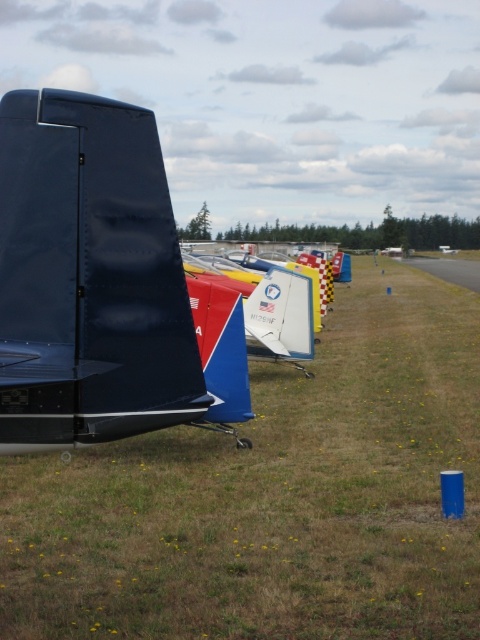
Question: Considering the real-world distances, which object is closest to the green grass at center?

Choices:
 (A) metallic silver airplane at center
 (B) matte black airplane at center

Answer: (B)

Question: Which point is closer to the camera?

Choices:
 (A) matte black airplane at center
 (B) metallic silver airplane at center

Answer: (A)

Question: Can you confirm if matte black airplane at center is smaller than metallic silver airplane at center?

Choices:
 (A) yes
 (B) no

Answer: (B)

Question: In this image, where is green grass at center located relative to matte black airplane at center?

Choices:
 (A) right
 (B) left

Answer: (A)

Question: Among these points, which one is farthest from the camera?

Choices:
 (A) (231, 369)
 (B) (412, 525)
 (C) (456, 248)

Answer: (C)

Question: Observing the image, what is the correct spatial positioning of matte black airplane at center in reference to metallic silver airplane at center?

Choices:
 (A) below
 (B) above

Answer: (A)